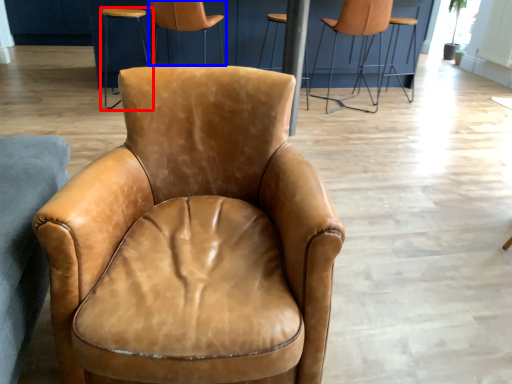
Question: Among these objects, which one is farthest to the camera, stool (highlighted by a red box) or chair (highlighted by a blue box)?

Choices:
 (A) stool
 (B) chair

Answer: (A)